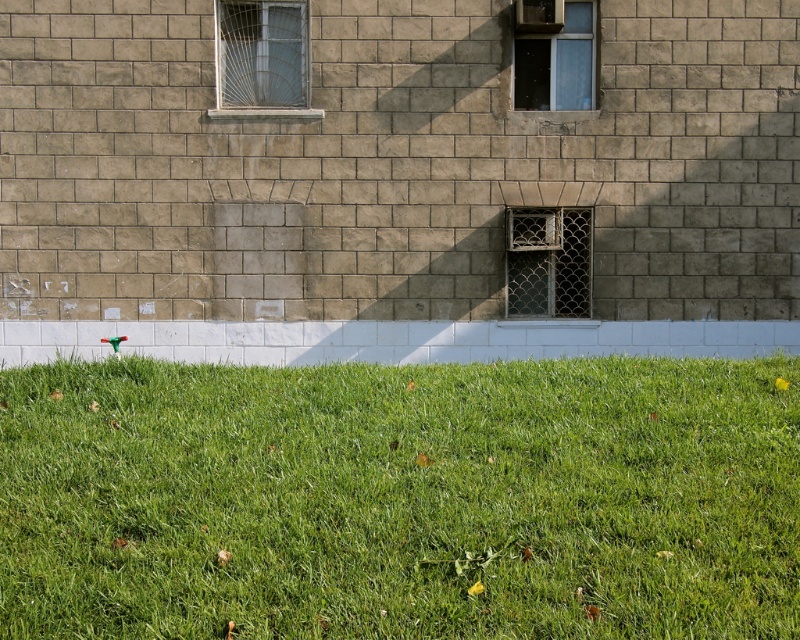
You are standing in front of the building and notice two points marked on the wall. Which point, point (668, 371) or point (580, 65), is closer to you?

Point (668, 371) is closer to the viewer than point (580, 65).